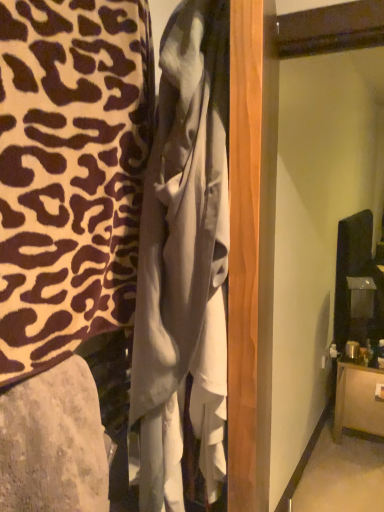
Image resolution: width=384 pixels, height=512 pixels. Find the location of `brown wood cabinet at lower right, the 1th furniture when ordered from back to front`. brown wood cabinet at lower right, the 1th furniture when ordered from back to front is located at coordinates (358, 400).

Where is `brown wood cabinet at lower right, which is the third furniture in left-to-right order`? The image size is (384, 512). brown wood cabinet at lower right, which is the third furniture in left-to-right order is located at coordinates (358, 400).

Is matte gray fabric at lower left, positioned as the second furniture in right-to-left order, at the right side of brown wood cabinet at lower right, which appears as the 3th furniture when viewed from the top?

In fact, matte gray fabric at lower left, positioned as the second furniture in right-to-left order, is to the left of brown wood cabinet at lower right, which appears as the 3th furniture when viewed from the top.

Considering the positions of point (3, 460) and point (368, 432), is point (3, 460) closer or farther from the camera than point (368, 432)?

Point (3, 460).

Are matte gray fabric at lower left, positioned as the second furniture in bottom-to-top order, and brown wood cabinet at lower right, the 1th furniture positioned from the right, beside each other?

No, matte gray fabric at lower left, positioned as the second furniture in bottom-to-top order, is not in contact with brown wood cabinet at lower right, the 1th furniture positioned from the right.

Is matte gray fabric at lower left, which is the 1th furniture in front-to-back order, inside the boundaries of brown wood cabinet at lower right, the 1th furniture when ordered from back to front, or outside?

Result: matte gray fabric at lower left, which is the 1th furniture in front-to-back order, is not enclosed by brown wood cabinet at lower right, the 1th furniture when ordered from back to front.

Based on the photo, from a real-world perspective, between white satin dress at center and matte gray fabric at lower left, positioned as the second furniture in right-to-left order, who is vertically higher?

From a 3D spatial view, white satin dress at center is above.

Are white satin dress at center and matte gray fabric at lower left, which is the 1th furniture in front-to-back order, making contact?

No, white satin dress at center is not next to matte gray fabric at lower left, which is the 1th furniture in front-to-back order.

Could you tell me if white satin dress at center is facing matte gray fabric at lower left, positioned as the second furniture in bottom-to-top order?

No, white satin dress at center is not turned towards matte gray fabric at lower left, positioned as the second furniture in bottom-to-top order.

Is white satin dress at center thinner than brown wood cabinet at lower right, which appears as the 3th furniture when viewed from the top?

Yes.

Between white satin dress at center and brown wood cabinet at lower right, which appears as the 3th furniture when viewed from the top, which one is positioned in front?

white satin dress at center.

In the scene shown: Which is more to the left, white satin dress at center or brown wood cabinet at lower right, which is the third furniture in left-to-right order?

white satin dress at center.

Which point is more distant from viewer, (170,295) or (377,424)?

The point (377,424) is farther.

From a real-world perspective, which is physically below, brown wood cabinet at lower right, the third furniture in the front-to-back sequence, or leopard print fabric at left, arranged as the 1th furniture when viewed from the top?

brown wood cabinet at lower right, the third furniture in the front-to-back sequence.

Measure the distance from brown wood cabinet at lower right, which appears as the 3th furniture when viewed from the top, to leopard print fabric at left, acting as the 2th furniture starting from the front.

brown wood cabinet at lower right, which appears as the 3th furniture when viewed from the top, is 8.89 feet away from leopard print fabric at left, acting as the 2th furniture starting from the front.

Is brown wood cabinet at lower right, which appears as the 3th furniture when viewed from the top, in contact with leopard print fabric at left, the first furniture when ordered from left to right?

No, brown wood cabinet at lower right, which appears as the 3th furniture when viewed from the top, is not touching leopard print fabric at left, the first furniture when ordered from left to right.

Based on the photo, can you tell me how much brown wood cabinet at lower right, the 1th furniture positioned from the right, and leopard print fabric at left, marked as the 3th furniture in a bottom-to-top arrangement, differ in facing direction?

1.84 degrees.

Could you tell me if brown wood cabinet at lower right, the 1th furniture when ordered from back to front, is turned towards white satin dress at center?

No, brown wood cabinet at lower right, the 1th furniture when ordered from back to front, does not turn towards white satin dress at center.

Is brown wood cabinet at lower right, the third furniture in the front-to-back sequence, further to the viewer compared to white satin dress at center?

Yes.

Is brown wood cabinet at lower right, which appears as the 3th furniture when viewed from the top, in contact with white satin dress at center?

No, brown wood cabinet at lower right, which appears as the 3th furniture when viewed from the top, is not next to white satin dress at center.

Is white satin dress at center completely or partially inside brown wood cabinet at lower right, the 1th furniture positioned from the bottom?

No, white satin dress at center is not surrounded by brown wood cabinet at lower right, the 1th furniture positioned from the bottom.

Based on the photo, who is bigger, matte gray fabric at lower left, positioned as the second furniture in bottom-to-top order, or white satin dress at center?

With larger size is white satin dress at center.

Consider the image. Which of these two, matte gray fabric at lower left, positioned as the second furniture in right-to-left order, or white satin dress at center, is thinner?

Thinner between the two is white satin dress at center.

Considering the relative positions of matte gray fabric at lower left, positioned as the second furniture in right-to-left order, and white satin dress at center in the image provided, is matte gray fabric at lower left, positioned as the second furniture in right-to-left order, behind white satin dress at center?

No, matte gray fabric at lower left, positioned as the second furniture in right-to-left order, is in front of white satin dress at center.

Does point (98, 438) lie behind point (169, 83)?

Yes, point (98, 438) is behind point (169, 83).

Considering the sizes of objects white satin dress at center and leopard print fabric at left, acting as the 2th furniture starting from the front, in the image provided, who is smaller, white satin dress at center or leopard print fabric at left, acting as the 2th furniture starting from the front,?

white satin dress at center.

Is point (204, 366) closer to camera compared to point (61, 191)?

No, it is behind (61, 191).

Based on the photo, is white satin dress at center to the left or to the right of leopard print fabric at left, arranged as the 1th furniture when viewed from the top, in the image?

Based on their positions, white satin dress at center is located to the right of leopard print fabric at left, arranged as the 1th furniture when viewed from the top.

The width and height of the screenshot is (384, 512). I want to click on furniture that is the 2nd one when counting backward from the matte gray fabric at lower left, which is the 1th furniture in front-to-back order, so click(x=358, y=400).

Which furniture is the 2nd one when counting from the front of the white satin dress at center? Please provide its 2D coordinates.

[(53, 443)]

Looking at the image, which one is located closer to brown wood cabinet at lower right, the 1th furniture positioned from the right, matte gray fabric at lower left, positioned as the second furniture in bottom-to-top order, or white satin dress at center?

white satin dress at center lies closer to brown wood cabinet at lower right, the 1th furniture positioned from the right, than the other object.

Based on the photo, which object lies nearer to the anchor point brown wood cabinet at lower right, which is the third furniture in left-to-right order, white satin dress at center or matte gray fabric at lower left, positioned as the second furniture in right-to-left order?

The object closer to brown wood cabinet at lower right, which is the third furniture in left-to-right order, is white satin dress at center.

Estimate the real-world distances between objects in this image. Which object is closer to brown wood cabinet at lower right, the 1th furniture positioned from the bottom, white satin dress at center or leopard print fabric at left, placed as the third furniture when sorted from right to left?

Based on the image, white satin dress at center appears to be nearer to brown wood cabinet at lower right, the 1th furniture positioned from the bottom.

Based on their spatial positions, is leopard print fabric at left, marked as the 3th furniture in a bottom-to-top arrangement, or white satin dress at center further from brown wood cabinet at lower right, the 1th furniture positioned from the bottom?

leopard print fabric at left, marked as the 3th furniture in a bottom-to-top arrangement, is further to brown wood cabinet at lower right, the 1th furniture positioned from the bottom.

Based on the photo, based on their spatial positions, is brown wood cabinet at lower right, the third furniture in the front-to-back sequence, or matte gray fabric at lower left, the 2th furniture positioned from the top, closer to leopard print fabric at left, marked as the 3th furniture in a bottom-to-top arrangement?

The object closer to leopard print fabric at left, marked as the 3th furniture in a bottom-to-top arrangement, is matte gray fabric at lower left, the 2th furniture positioned from the top.

Which object lies further to the anchor point leopard print fabric at left, the first furniture when ordered from left to right, matte gray fabric at lower left, positioned as the second furniture in right-to-left order, or white satin dress at center?

matte gray fabric at lower left, positioned as the second furniture in right-to-left order, lies further to leopard print fabric at left, the first furniture when ordered from left to right, than the other object.

When comparing their distances from white satin dress at center, does leopard print fabric at left, arranged as the 1th furniture when viewed from the top, or matte gray fabric at lower left, the second furniture in the left-to-right sequence, seem further?

matte gray fabric at lower left, the second furniture in the left-to-right sequence, is further to white satin dress at center.

Which object lies nearer to the anchor point leopard print fabric at left, the first furniture when ordered from left to right, matte gray fabric at lower left, the second furniture in the left-to-right sequence, or brown wood cabinet at lower right, the third furniture in the front-to-back sequence?

matte gray fabric at lower left, the second furniture in the left-to-right sequence, lies closer to leopard print fabric at left, the first furniture when ordered from left to right, than the other object.

This screenshot has height=512, width=384. Find the location of `clothing between matte gray fabric at lower left, the second furniture in the left-to-right sequence, and brown wood cabinet at lower right, the 1th furniture when ordered from back to front, from front to back`. clothing between matte gray fabric at lower left, the second furniture in the left-to-right sequence, and brown wood cabinet at lower right, the 1th furniture when ordered from back to front, from front to back is located at coordinates (184, 260).

The height and width of the screenshot is (512, 384). I want to click on clothing between leopard print fabric at left, arranged as the 1th furniture when viewed from the top, and matte gray fabric at lower left, the 2th furniture positioned from the top, in the up-down direction, so [x=184, y=260].

Locate an element on the screen. furniture positioned between matte gray fabric at lower left, positioned as the second furniture in right-to-left order, and brown wood cabinet at lower right, the 1th furniture positioned from the right, from near to far is located at coordinates click(70, 173).

This screenshot has height=512, width=384. In order to click on clothing between leopard print fabric at left, acting as the 2th furniture starting from the front, and brown wood cabinet at lower right, which appears as the 3th furniture when viewed from the top, in the front-back direction in this screenshot , I will do `click(184, 260)`.